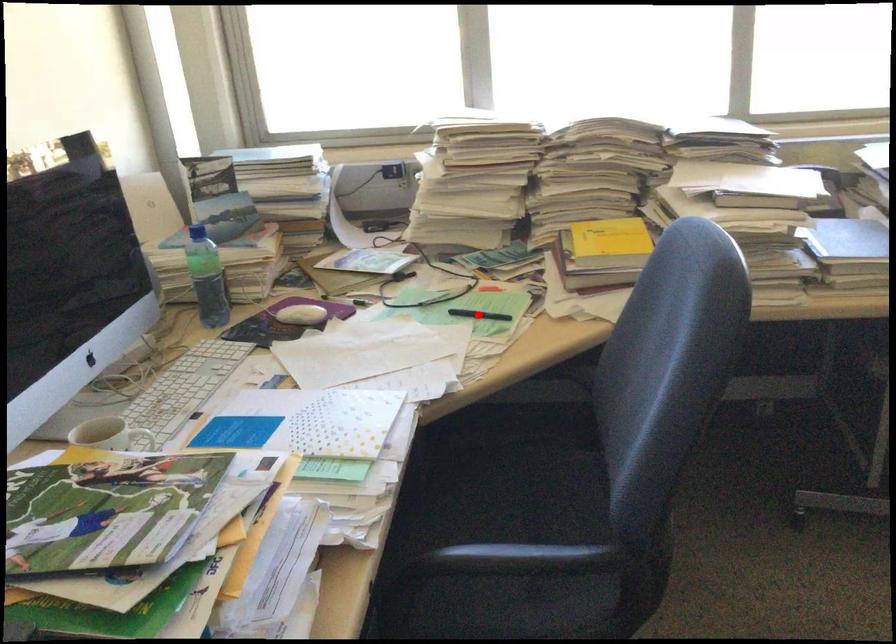
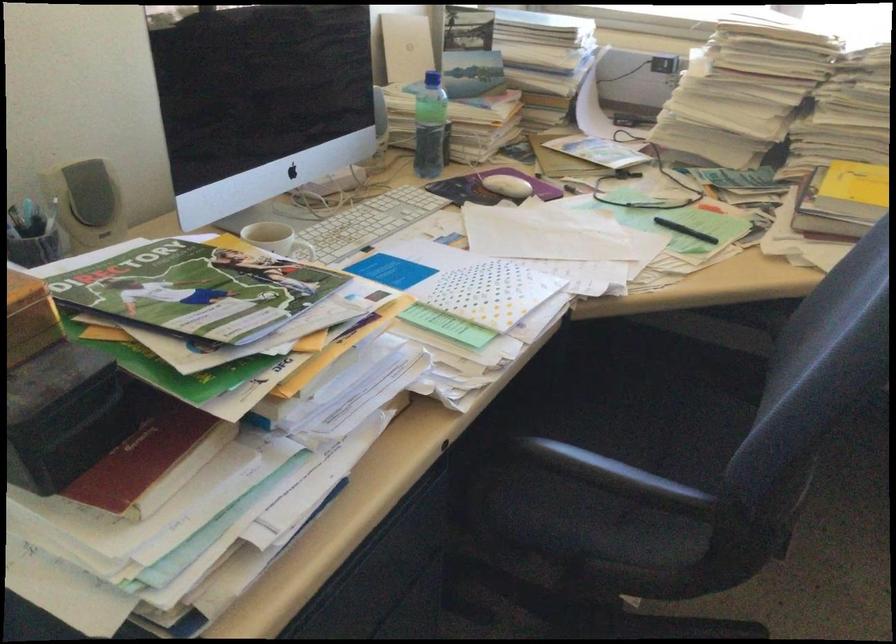
Find the pixel in the second image that matches the highlighted location in the first image.

(684, 230)